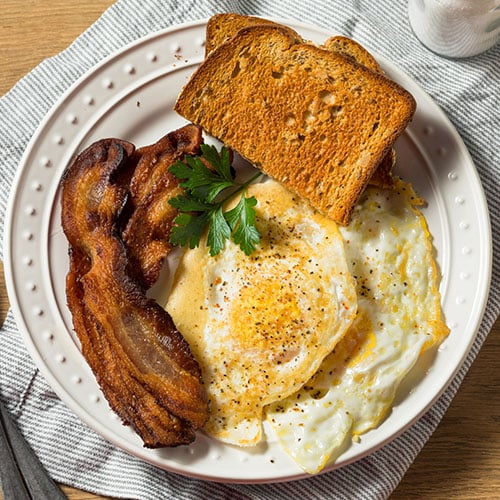
Find the location of a particular element. This screenshot has width=500, height=500. coffee cup is located at coordinates (452, 28).